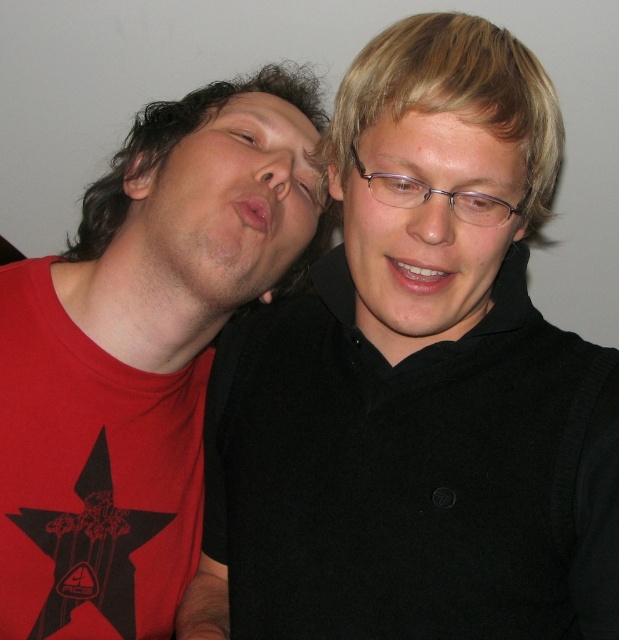
Which of these two, matte black glasses at center or brown matte eye at upper center, stands shorter?

brown matte eye at upper center is shorter.

Is point (524, 163) closer to camera compared to point (227, 128)?

Yes, it is in front of point (227, 128).

This screenshot has height=640, width=619. In order to click on matte black glasses at center in this screenshot , I will do `click(417, 266)`.

Does matte red t-shirt at left have a larger size compared to clear plastic eye at center?

Yes, matte red t-shirt at left is bigger than clear plastic eye at center.

The image size is (619, 640). What do you see at coordinates (139, 355) in the screenshot?
I see `matte red t-shirt at left` at bounding box center [139, 355].

Which is in front, point (219, 129) or point (391, 180)?

Positioned in front is point (391, 180).

At what (x,y) coordinates should I click in order to perform the action: click on matte red t-shirt at left. Please return your answer as a coordinate pair (x, y). This screenshot has height=640, width=619. Looking at the image, I should click on (139, 355).

At what (x,y) coordinates should I click in order to perform the action: click on matte black glasses at center. Please return your answer as a coordinate pair (x, y). Looking at the image, I should click on (417, 266).

Is matte black glasses at center taller than translucent plastic eye at center?

Indeed, matte black glasses at center has a greater height compared to translucent plastic eye at center.

Is point (396, 124) positioned behind point (500, 216)?

No.

You are a GUI agent. You are given a task and a screenshot of the screen. Output one action in this format:
    pyautogui.click(x=<x>, y=<y>)
    Task: Click on the matte black glasses at center
    The image size is (619, 640).
    Given the screenshot: What is the action you would take?
    pyautogui.click(x=417, y=266)